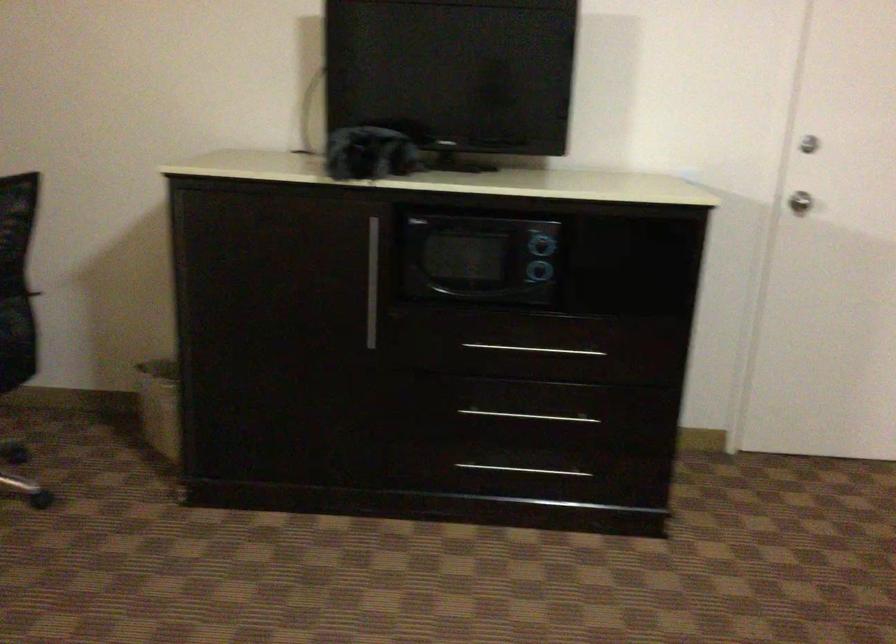
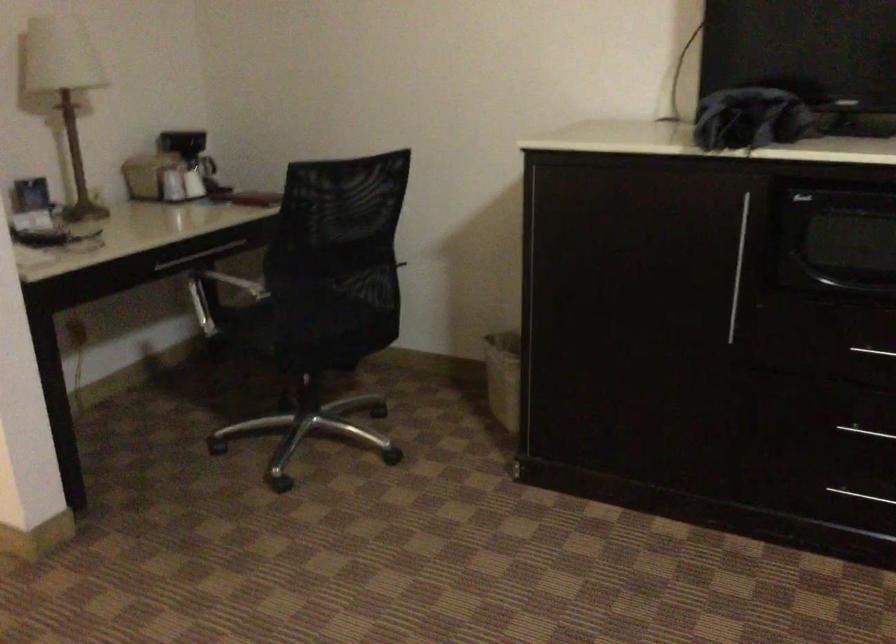
Question: The camera is either moving clockwise (left) or counter-clockwise (right) around the object. The first image is from the beginning of the video and the second image is from the end. Is the camera moving left or right when shooting the video?

Choices:
 (A) Left
 (B) Right

Answer: (B)